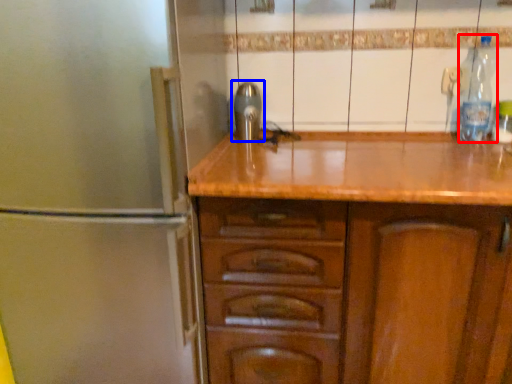
Question: Which object appears closest to the camera in this image, bottle (highlighted by a red box) or tap (highlighted by a blue box)?

Choices:
 (A) bottle
 (B) tap

Answer: (A)